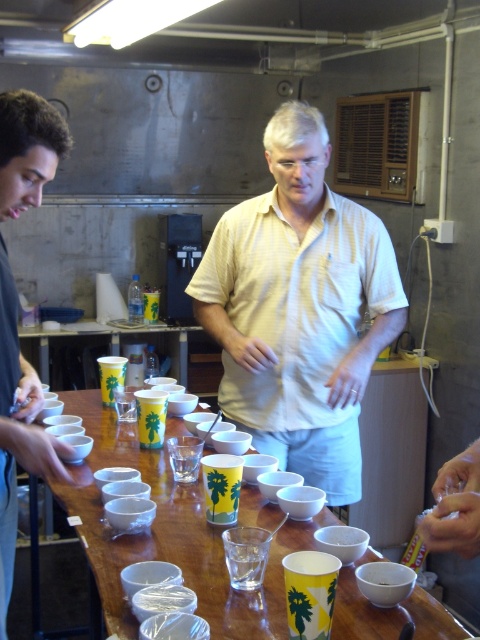
Which is behind, point (316, 324) or point (180, 324)?

Point (180, 324)

Who is more distant from viewer, (277, 333) or (178, 332)?

Point (178, 332)

Identify the location of yellow striped shirt at center. (300, 308).

Does yellow striped shirt at center have a greater width compared to wooden table at center?

No.

Is point (321, 188) closer to camera compared to point (218, 541)?

No, (321, 188) is behind (218, 541).

Where is `yellow striped shirt at center`? This screenshot has width=480, height=640. yellow striped shirt at center is located at coordinates (300, 308).

Is point (375, 225) farther from viewer compared to point (24, 365)?

Yes.

Between point (310, 109) and point (37, 122), which one is positioned behind?

The point (310, 109) is more distant.

Locate an element on the screen. Image resolution: width=480 pixels, height=640 pixels. yellow striped shirt at center is located at coordinates (300, 308).